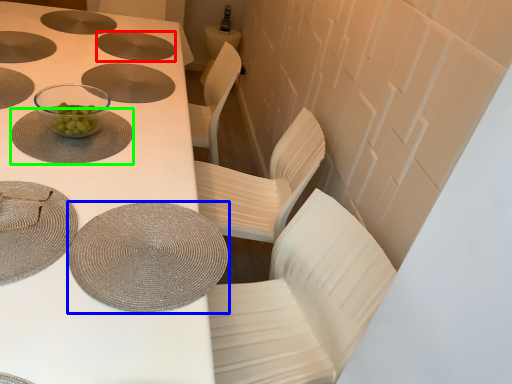
Question: Which object is the closest to the tableware (highlighted by a red box)? Choose among these: tableware (highlighted by a blue box) or tableware (highlighted by a green box).

Choices:
 (A) tableware
 (B) tableware

Answer: (B)